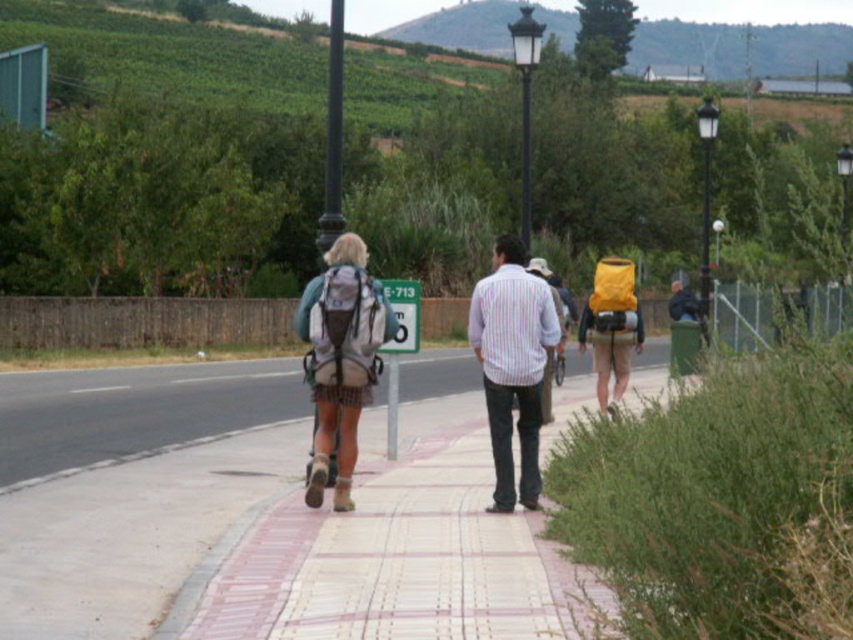
You are a hiker who wants to know if the paved sidewalk at center is taller than the striped cotton shirt at center. Based on the scene, can you determine which is taller?

The paved sidewalk at center is not as tall as striped cotton shirt at center, so the striped cotton shirt at center is taller.

In the scene shown: You are standing at the starting point of the hike marked by the signpost. You want to take a photo of the paved sidewalk at center from a distance that ensures it fills the frame without being too close. Considering the camera has a standard lens with a focal length of 50mm, what is the minimum distance you should stand from the sidewalk to achieve this?

The paved sidewalk at center is 6.34 meters away from the camera. To ensure it fills the frame without being too close, you should stand at least 6.34 meters away from the sidewalk.